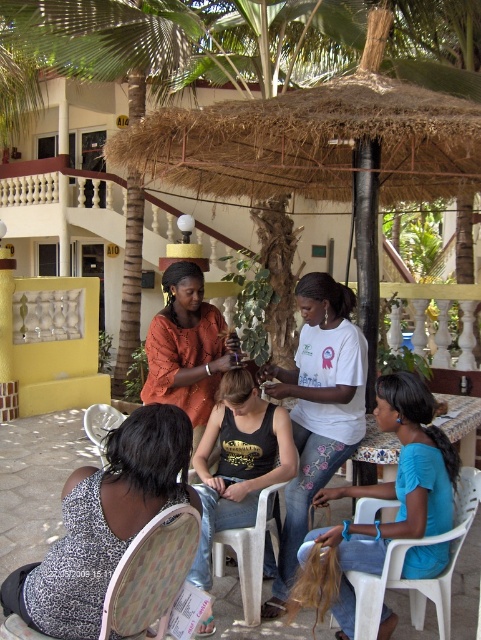
Is point (217, 522) more distant than point (97, 422)?

No, it is not.

Does black tank top at center have a lesser height compared to white plastic chair at lower left?

No, black tank top at center is not shorter than white plastic chair at lower left.

Does point (206, 486) lie behind point (115, 422)?

No, it is in front of (115, 422).

I want to click on black tank top at center, so click(x=239, y=461).

Is point (332, 492) in front of point (88, 420)?

Yes.

This screenshot has width=481, height=640. In order to click on blue fabric hair at lower right in this screenshot , I will do `click(392, 490)`.

Can you confirm if black tank top at center is bigger than white plastic chair at lower right?

Yes, black tank top at center is bigger than white plastic chair at lower right.

Is point (220, 515) less distant than point (387, 584)?

No, it is not.

Where is `black tank top at center`? black tank top at center is located at coordinates (239, 461).